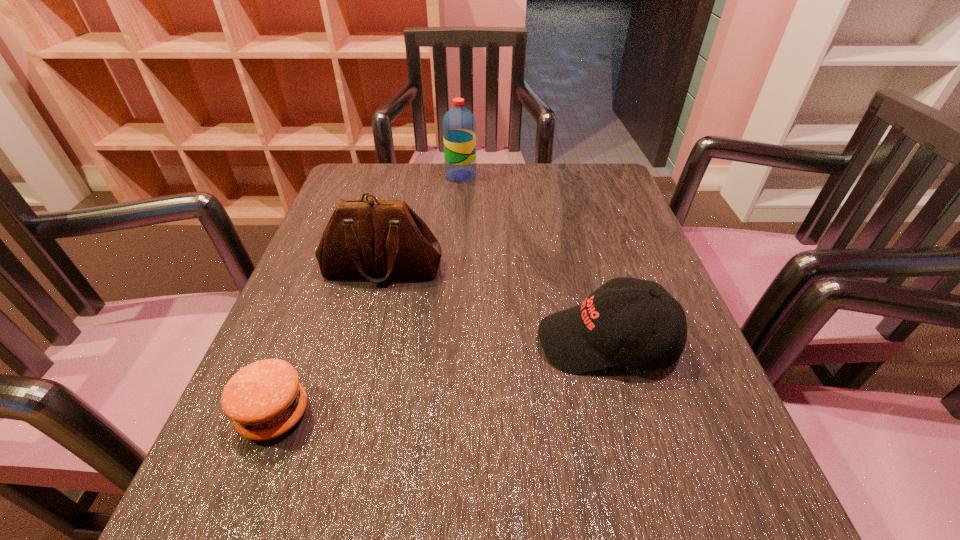
Identify the location of free space located 0.360m on the front-facing side of the rightmost object. The height and width of the screenshot is (540, 960). (330, 342).

Locate an element on the screen. free space located on the front-facing side of the rightmost object is located at coordinates (497, 342).

In order to click on vacant space located on the back of the patty in this screenshot , I will do `click(306, 332)`.

You are a GUI agent. You are given a task and a screenshot of the screen. Output one action in this format:
    pyautogui.click(x=<x>, y=<y>)
    Task: Click on the object that is at the far edge
    This screenshot has height=540, width=960.
    Given the screenshot: What is the action you would take?
    pyautogui.click(x=459, y=126)

Locate an element on the screen. shoulder bag at the left edge is located at coordinates (375, 239).

Find the location of a particular element. This screenshot has height=540, width=960. patty that is at the left edge is located at coordinates (264, 399).

Identify the location of object at the right edge. (591, 336).

Where is `free space at the far edge of the desktop`? The height and width of the screenshot is (540, 960). free space at the far edge of the desktop is located at coordinates (528, 183).

The height and width of the screenshot is (540, 960). Find the location of `vacant space at the left edge of the desktop`. vacant space at the left edge of the desktop is located at coordinates (295, 322).

Locate an element on the screen. vacant space at the right edge of the desktop is located at coordinates (593, 219).